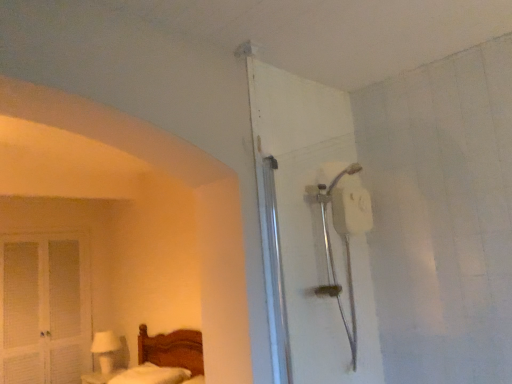
The height and width of the screenshot is (384, 512). Identify the location of white fluffy mattress at lower left. (152, 375).

Where is `white matte shower head at upper right`? This screenshot has width=512, height=384. white matte shower head at upper right is located at coordinates tap(270, 242).

Locate an element on the screen. This screenshot has width=512, height=384. table lamp positioned vertically above the white fluffy mattress at lower left (from a real-world perspective) is located at coordinates (106, 351).

Is white fluffy mattress at lower left to the left of white glossy table lamp at lower left from the viewer's perspective?

In fact, white fluffy mattress at lower left is to the right of white glossy table lamp at lower left.

Is white fluffy mattress at lower left turned away from white glossy table lamp at lower left?

No, white fluffy mattress at lower left's orientation is not away from white glossy table lamp at lower left.

Considering the relative sizes of white fluffy mattress at lower left and white glossy table lamp at lower left in the image provided, is white fluffy mattress at lower left thinner than white glossy table lamp at lower left?

No, white fluffy mattress at lower left is not thinner than white glossy table lamp at lower left.

Is white matte shower head at upper right not close to white louvered screen door at left?

Yes, white matte shower head at upper right and white louvered screen door at left are quite far apart.

From the image's perspective, is white matte shower head at upper right above white louvered screen door at left?

Yes.

Which object is positioned more to the right, white matte shower head at upper right or white louvered screen door at left?

white matte shower head at upper right.

How different are the orientations of white matte shower head at upper right and white louvered screen door at left in degrees?

white matte shower head at upper right and white louvered screen door at left are facing 2.37 degrees away from each other.

Would you say white glossy table lamp at lower left is outside white louvered screen door at left?

Yes, white glossy table lamp at lower left is located beyond the bounds of white louvered screen door at left.

Based on the photo, is there a large distance between white glossy table lamp at lower left and white louvered screen door at left?

Actually, white glossy table lamp at lower left and white louvered screen door at left are a little close together.

Could you tell me if white glossy table lamp at lower left is turned towards white louvered screen door at left?

No.

From a real-world perspective, which object stands above the other?

white louvered screen door at left is physically above.

From the image's perspective, which is below, white louvered screen door at left or white glossy table lamp at lower left?

white glossy table lamp at lower left, from the image's perspective.

In the scene shown: Which is more to the right, white louvered screen door at left or white glossy table lamp at lower left?

white glossy table lamp at lower left is more to the right.

Does white louvered screen door at left have a lesser width compared to white glossy table lamp at lower left?

Indeed, white louvered screen door at left has a lesser width compared to white glossy table lamp at lower left.

In the scene shown: Who is shorter, white louvered screen door at left or white glossy table lamp at lower left?

With less height is white glossy table lamp at lower left.

Which point is more forward, [113,370] or [136,380]?

The point [136,380] is closer to the camera.

Considering the relative positions of white glossy table lamp at lower left and white fluffy mattress at lower left in the image provided, is white glossy table lamp at lower left to the left or to the right of white fluffy mattress at lower left?

Clearly, white glossy table lamp at lower left is on the left of white fluffy mattress at lower left in the image.

Is white fluffy mattress at lower left at the back of white glossy table lamp at lower left?

No.

Can you confirm if white glossy table lamp at lower left is smaller than white fluffy mattress at lower left?

Yes.

From a real-world perspective, is white louvered screen door at left on top of white matte shower head at upper right?

Incorrect, from a real-world perspective, white louvered screen door at left is lower than white matte shower head at upper right.

Which of these two, white louvered screen door at left or white matte shower head at upper right, is bigger?

white louvered screen door at left.

In the scene shown: Does white louvered screen door at left turn towards white matte shower head at upper right?

Yes, white louvered screen door at left is facing white matte shower head at upper right.

Measure the distance between white louvered screen door at left and white matte shower head at upper right.

They are 3.10 meters apart.

From the image's perspective, between white matte shower head at upper right and white fluffy mattress at lower left, which one is located above?

white matte shower head at upper right appears higher in the image.

From the picture: What's the angular difference between white matte shower head at upper right and white fluffy mattress at lower left's facing directions?

There is a 91.6-degree angle between the facing directions of white matte shower head at upper right and white fluffy mattress at lower left.

You are a GUI agent. You are given a task and a screenshot of the screen. Output one action in this format:
    pyautogui.click(x=<x>, y=<y>)
    Task: Click on the door above the white fluffy mattress at lower left (from the image's perspective)
    The image size is (512, 384).
    Given the screenshot: What is the action you would take?
    point(270,242)

Can you confirm if white matte shower head at upper right is shorter than white fluffy mattress at lower left?

In fact, white matte shower head at upper right may be taller than white fluffy mattress at lower left.

Locate an element on the screen. This screenshot has height=384, width=512. table lamp behind the white fluffy mattress at lower left is located at coordinates (106, 351).

Locate an element on the screen. The width and height of the screenshot is (512, 384). screen door below the white matte shower head at upper right (from the image's perspective) is located at coordinates (44, 310).

Estimate the real-world distances between objects in this image. Which object is further from white fluffy mattress at lower left, white louvered screen door at left or white matte shower head at upper right?

white matte shower head at upper right is further to white fluffy mattress at lower left.

When comparing their distances from white fluffy mattress at lower left, does white louvered screen door at left or white glossy table lamp at lower left seem further?

white louvered screen door at left is positioned further to the anchor white fluffy mattress at lower left.

Based on their spatial positions, is white fluffy mattress at lower left or white glossy table lamp at lower left closer to white matte shower head at upper right?

Based on the image, white fluffy mattress at lower left appears to be nearer to white matte shower head at upper right.

When comparing their distances from white matte shower head at upper right, does white louvered screen door at left or white fluffy mattress at lower left seem closer?

Based on the image, white fluffy mattress at lower left appears to be nearer to white matte shower head at upper right.

From the image, which object appears to be nearer to white glossy table lamp at lower left, white louvered screen door at left or white fluffy mattress at lower left?

white louvered screen door at left is closer to white glossy table lamp at lower left.

From the picture: Which object lies nearer to the anchor point white louvered screen door at left, white fluffy mattress at lower left or white glossy table lamp at lower left?

white glossy table lamp at lower left.

When comparing their distances from white glossy table lamp at lower left, does white matte shower head at upper right or white louvered screen door at left seem further?

The object further to white glossy table lamp at lower left is white matte shower head at upper right.

Considering their positions, is white matte shower head at upper right positioned closer to white louvered screen door at left than white glossy table lamp at lower left?

white glossy table lamp at lower left.

I want to click on mattress located between white matte shower head at upper right and white louvered screen door at left in the depth direction, so click(152, 375).

This screenshot has width=512, height=384. I want to click on table lamp between white louvered screen door at left and white fluffy mattress at lower left in the horizontal direction, so click(x=106, y=351).

The height and width of the screenshot is (384, 512). Identify the location of screen door located between white matte shower head at upper right and white glossy table lamp at lower left in the depth direction. (44, 310).

The height and width of the screenshot is (384, 512). I want to click on mattress between white matte shower head at upper right and white glossy table lamp at lower left along the z-axis, so click(x=152, y=375).